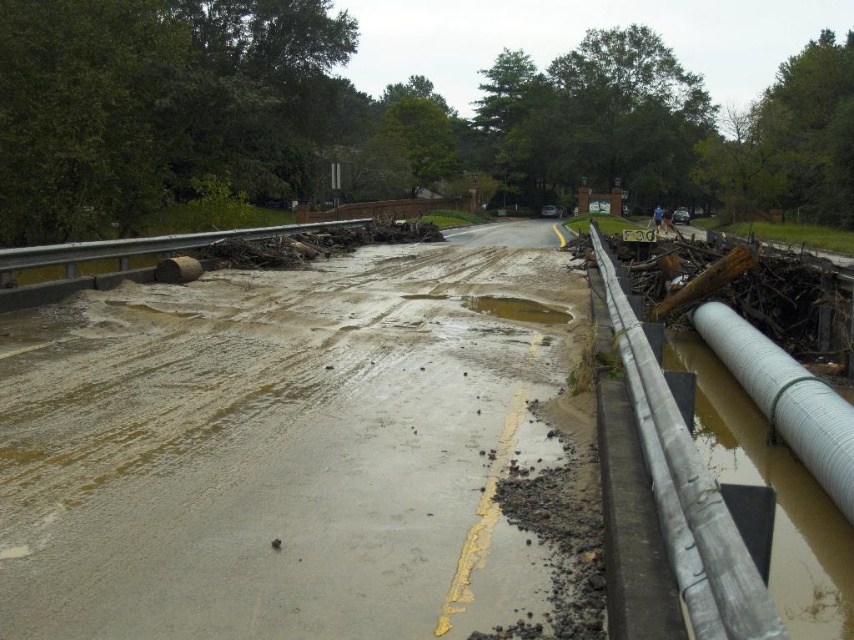
Question: In this image, where is muddy concrete road at center located relative to white corrugated pipe at right?

Choices:
 (A) left
 (B) right

Answer: (A)

Question: Does muddy concrete road at center have a larger size compared to white corrugated pipe at right?

Choices:
 (A) no
 (B) yes

Answer: (B)

Question: Which point is farther to the camera?

Choices:
 (A) (837, 406)
 (B) (478, 305)

Answer: (B)

Question: Which object appears farthest from the camera in this image?

Choices:
 (A) white corrugated pipe at right
 (B) muddy concrete road at center

Answer: (A)

Question: Which of these objects is positioned farthest from the muddy concrete road at center?

Choices:
 (A) white corrugated pipe at right
 (B) brown mud puddle at center

Answer: (A)

Question: Can you confirm if white corrugated pipe at right is smaller than brown mud puddle at center?

Choices:
 (A) yes
 (B) no

Answer: (A)